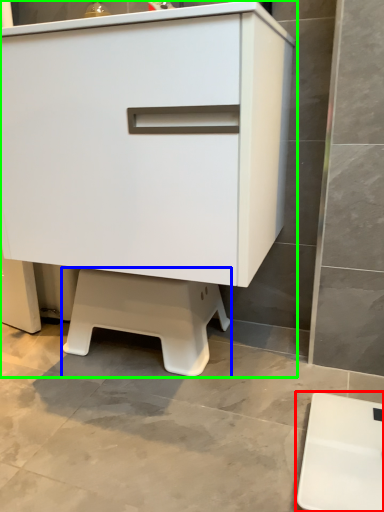
Question: Based on their relative distances, which object is farther from furniture (highlighted by a red box)? Choose from step stool (highlighted by a blue box) and chest of drawers (highlighted by a green box).

Choices:
 (A) step stool
 (B) chest of drawers

Answer: (B)